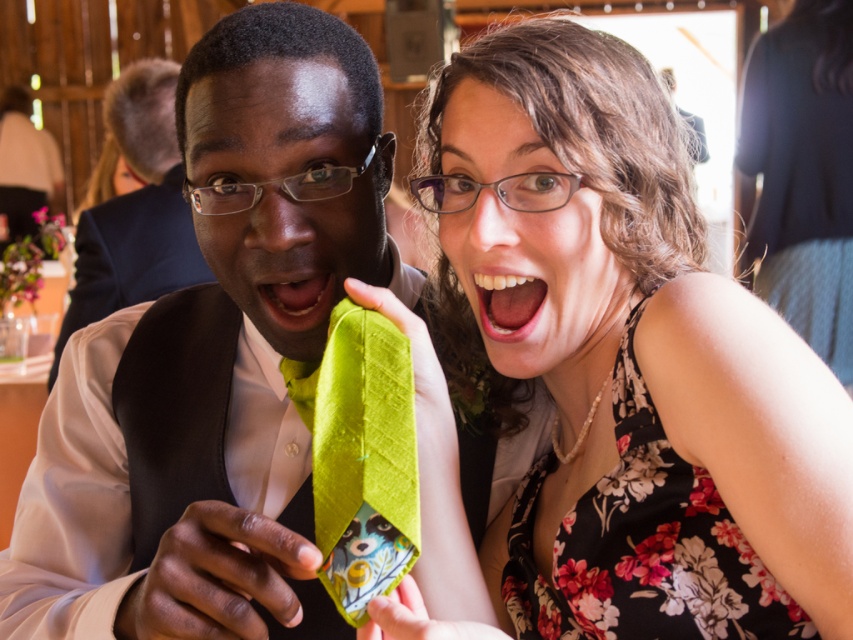
You are a photographer at a social event. You want to take a photo of the floral fabric dress at center and white glossy teeth at center. The minimum distance between the two subjects for your camera to focus properly is 6 inches. Can you take the photo with the current positioning?

The floral fabric dress at center and white glossy teeth at center are 6.35 inches apart, which is just over the 6 inch minimum requirement. Yes, you can take the photo with the current positioning.

Consider the image. You are a photographer at the event and want to capture a shot where both the floral fabric dress at center and the white glossy teeth at center are visible. Based on their positions, which object should appear higher in the photo?

The white glossy teeth at center appears higher in the photo because the floral fabric dress at center is positioned under it.

You are a photographer at the event and want to capture a closeup of the green silk tie at center and the white glossy teeth at center. Which object will appear larger in the photo?

The green silk tie at center will appear larger in the photo because it is closer to the viewer than the white glossy teeth at center.